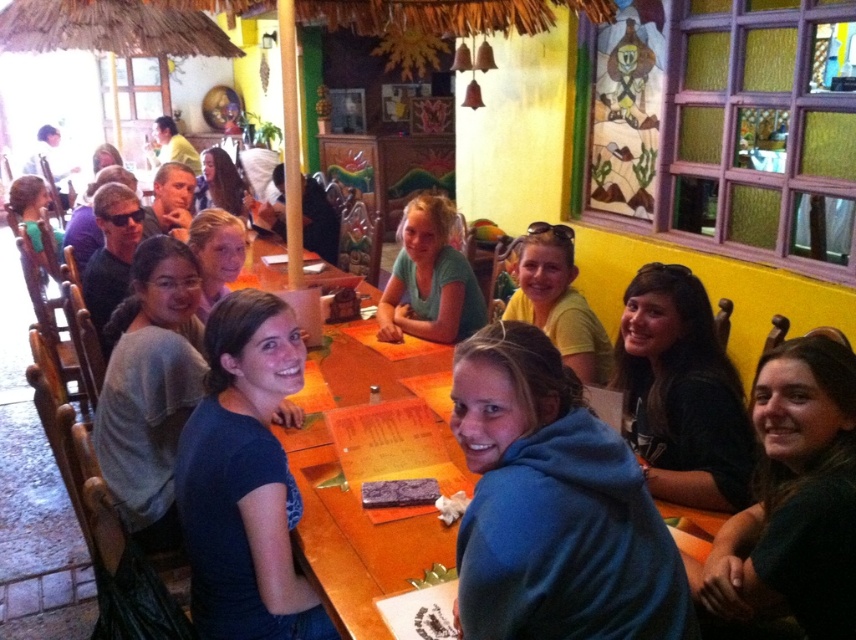
You are a server at the restaurant and need to place a large tray of food on the table. There is a blue fleece at center and a dark brown leather jacket at lower right on the table. Which item should you avoid placing the tray over to ensure it doesn

The blue fleece at center has a larger width than the dark brown leather jacket at lower right, so placing the tray over the blue fleece at center would require more space. To ensure the tray fits, avoid placing it over the blue fleece at center and instead choose an area near the dark brown leather jacket at lower right where there is more space available.

You are a photographer standing at the back of the room. You need to take a photo of the matte black hair at center and the matte green shirt at left so that both are fully visible. Given their heights, which subject should you position closer to the front to ensure both are visible?

Since the matte black hair at center is shorter than the matte green shirt at left, you should position the matte black hair at center closer to the front to avoid being blocked by the taller matte green shirt at left.

You are a photographer trying to capture a group photo of the matte black hair at center and the matte green shirt at left. Since you want to ensure both subjects are clearly visible, which subject should you focus on first considering their sizes?

The matte black hair at center is smaller than the matte green shirt at left, so you should focus on the matte black hair at center first to ensure its details are captured clearly.